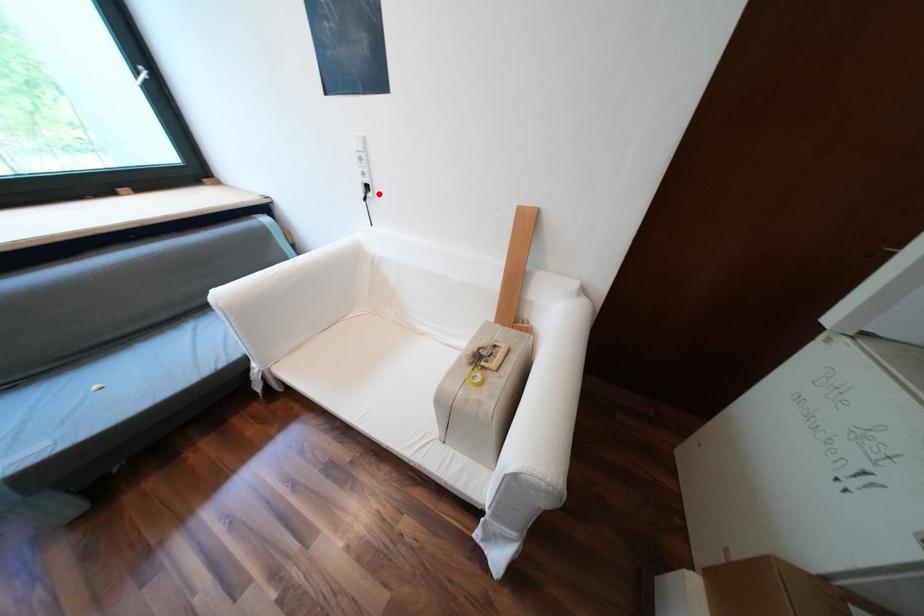
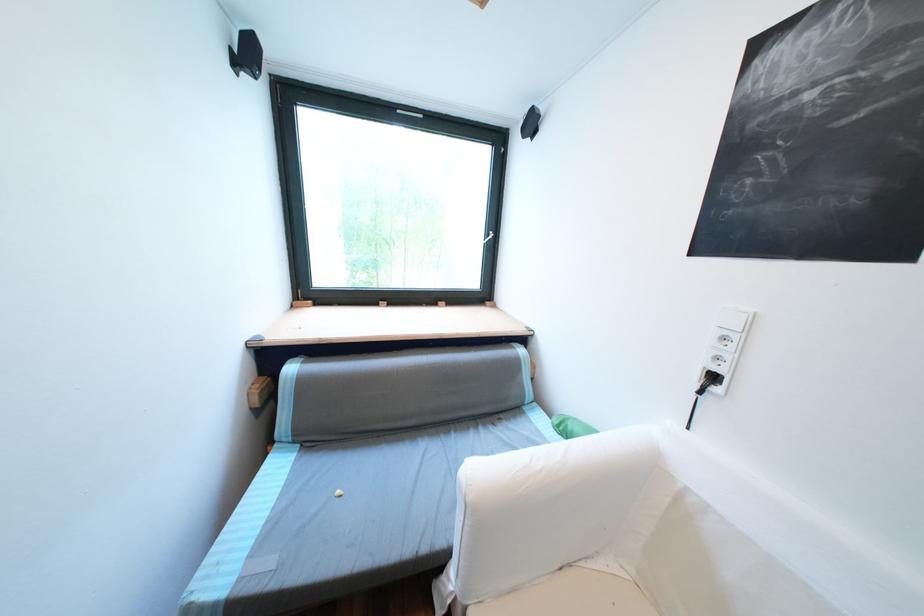
Question: I am providing you with two images of the same scene from different viewpoints. A red point is shown in image1. For the corresponding object point in image2, is it positioned nearer or farther from the camera?

Choices:
 (A) Nearer
 (B) Farther

Answer: (B)